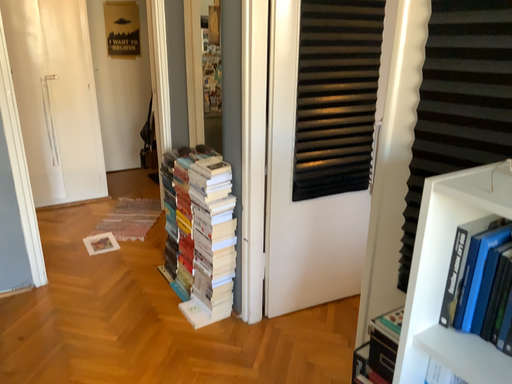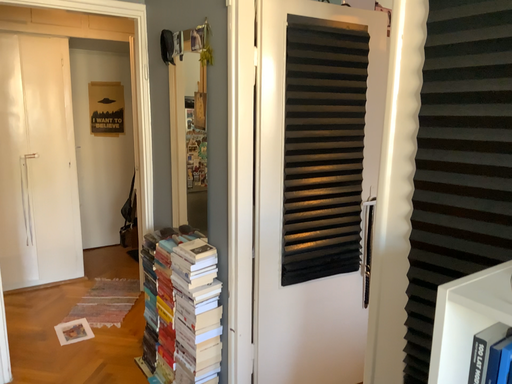
Question: Which way did the camera rotate in the video?

Choices:
 (A) rotated upward
 (B) rotated downward

Answer: (A)